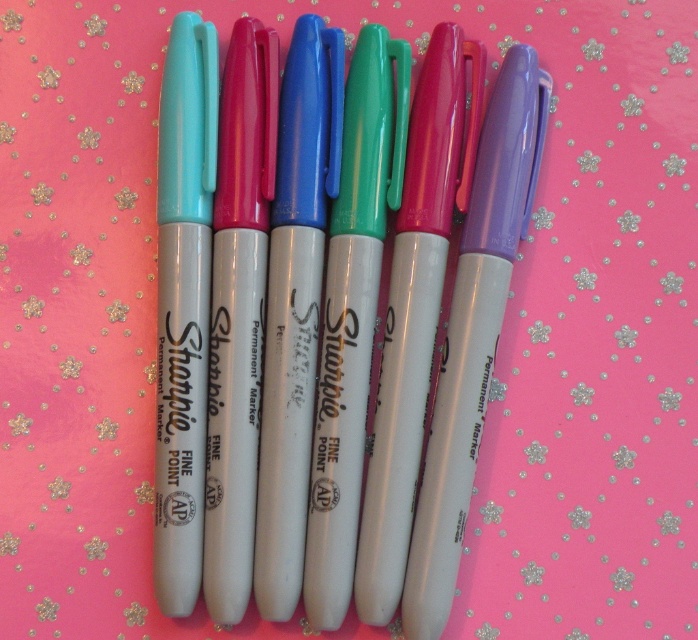
Question: Is matte white marker at center smaller than matte purple marker at center?

Choices:
 (A) yes
 (B) no

Answer: (B)

Question: Which object is closer to the camera taking this photo?

Choices:
 (A) matte purple marker at center
 (B) matte white marker at center

Answer: (B)

Question: Is matte white marker at center to the left of matte purple marker at center from the viewer's perspective?

Choices:
 (A) yes
 (B) no

Answer: (A)

Question: Which object is farther from the camera taking this photo?

Choices:
 (A) matte white marker at center
 (B) matte purple marker at center

Answer: (B)

Question: Which of the following is the closest to the observer?

Choices:
 (A) (475, 170)
 (B) (431, 584)

Answer: (B)

Question: Does matte white marker at center have a larger size compared to matte purple marker at center?

Choices:
 (A) no
 (B) yes

Answer: (B)